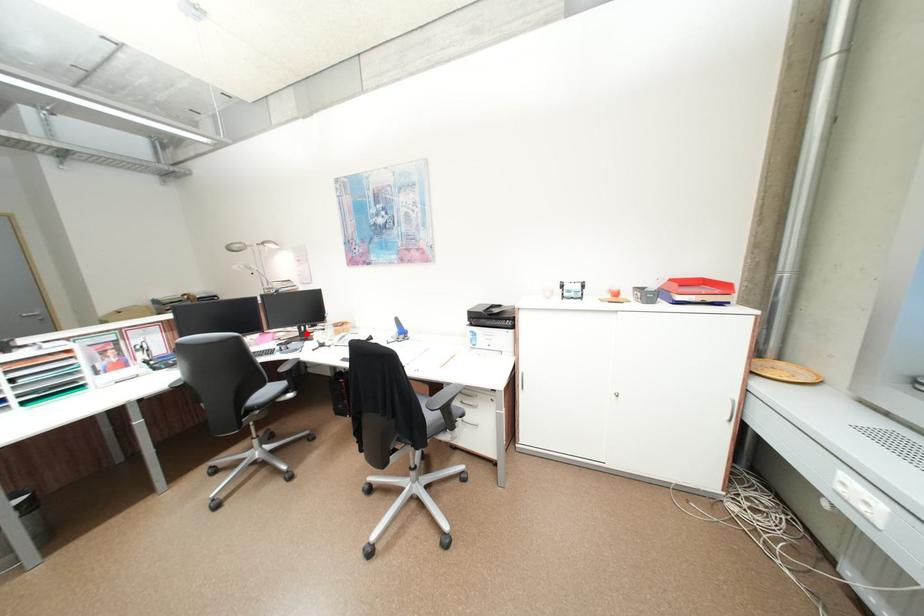
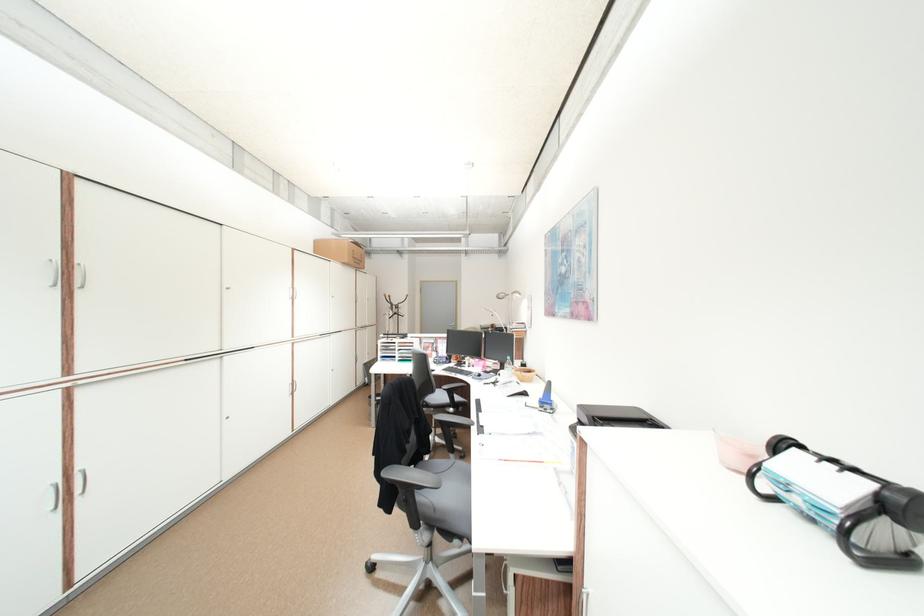
Question: A red point is marked in image1. In image2, is the corresponding 3D point closer to the camera or farther? Reply with the corresponding letter.

Choices:
 (A) The corresponding 3D point is closer.
 (B) The corresponding 3D point is farther.

Answer: (B)